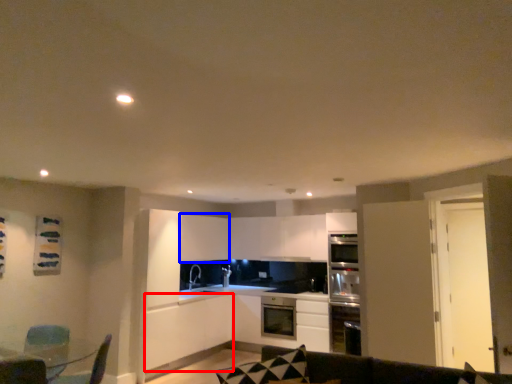
Question: Which object appears closest to the camera in this image, cabinetry (highlighted by a red box) or cabinetry (highlighted by a blue box)?

Choices:
 (A) cabinetry
 (B) cabinetry

Answer: (A)